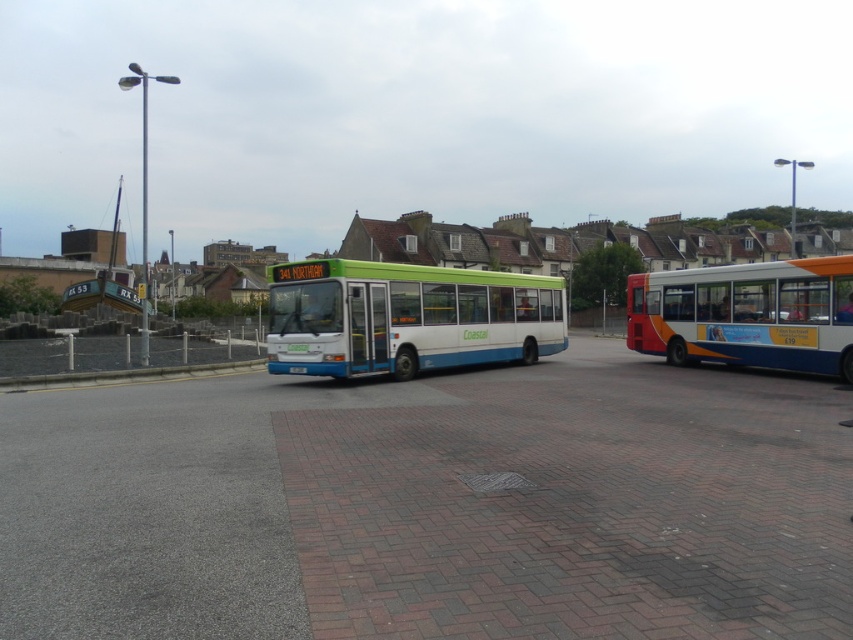
Where is `green matte bus at center`? green matte bus at center is located at coordinates (405, 317).

Does green matte bus at center appear on the right side of white plastic bus at right?

No, green matte bus at center is not to the right of white plastic bus at right.

Locate an element on the screen. green matte bus at center is located at coordinates (405, 317).

From the picture: Who is lower down, green matte bus at center or gray concrete curb at lower left?

gray concrete curb at lower left

Between point (335, 275) and point (164, 376), which one is positioned behind?

Point (164, 376)

You are a GUI agent. You are given a task and a screenshot of the screen. Output one action in this format:
    pyautogui.click(x=<x>, y=<y>)
    Task: Click on the green matte bus at center
    
    Given the screenshot: What is the action you would take?
    pyautogui.click(x=405, y=317)

Who is taller, white plastic bus at right or green plastic bus at center?

white plastic bus at right

Does point (685, 300) lie in front of point (70, 308)?

Yes, point (685, 300) is closer to viewer.

Locate an element on the screen. This screenshot has height=640, width=853. white plastic bus at right is located at coordinates (747, 314).

Identify the location of white plastic bus at right. This screenshot has width=853, height=640. (747, 314).